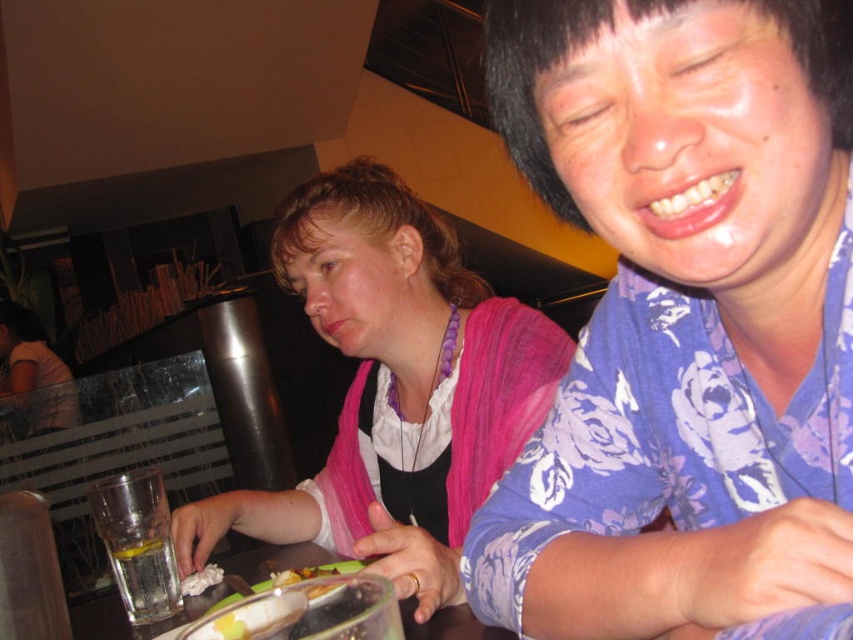
Question: Can you confirm if blue floral shirt at center is smaller than clear glass table at center?

Choices:
 (A) no
 (B) yes

Answer: (A)

Question: Which of the following is the farthest from the observer?

Choices:
 (A) clear glass water at lower left
 (B) clear glass table at center

Answer: (A)

Question: Which object is the farthest from the pink fabric scarf at center?

Choices:
 (A) clear glass water at lower left
 (B) shiny plastic fork at lower center

Answer: (A)

Question: Is translucent glass at lower left above shiny plastic fork at lower center?

Choices:
 (A) no
 (B) yes

Answer: (A)

Question: Which of these objects is positioned farthest from the clear glass table at center?

Choices:
 (A) pink fabric scarf at center
 (B) translucent glass at lower left
 (C) shiny plastic fork at lower center
 (D) blue floral shirt at center

Answer: (D)

Question: Is the position of blue floral shirt at center less distant than that of shiny plastic fork at lower center?

Choices:
 (A) yes
 (B) no

Answer: (A)